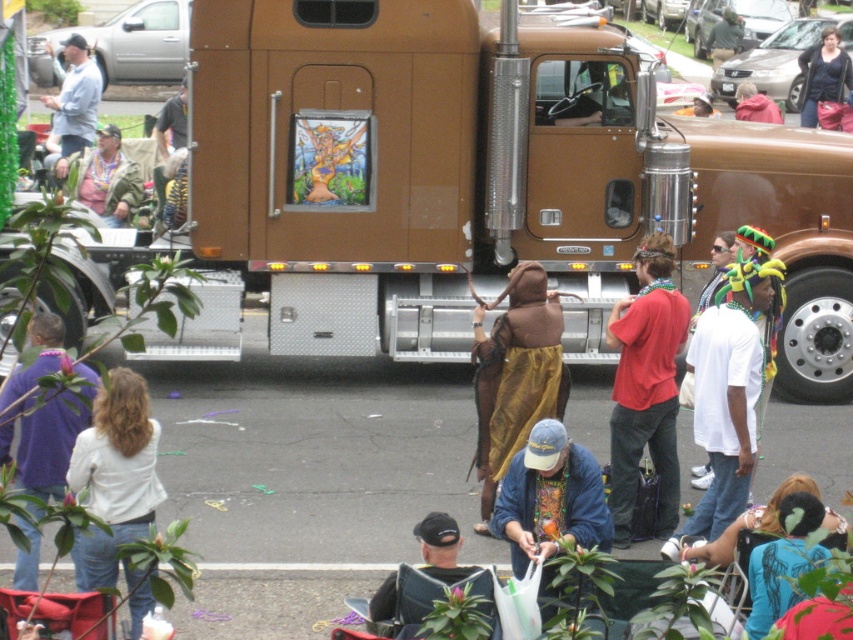
You are a photographer at the parade and want to take a photo of the red cotton shirt at center and the pink fabric at center. Which one is positioned to the left?

The red cotton shirt at center is to the left of the pink fabric at center.

You are standing at the position of the point at coordinates point [666,193] and want to walk towards the point at coordinates point [428,518]. Which direction should you move relative to the truck?

You should move towards the truck because point [666,193] is further away from the camera than point [428,518], meaning the latter is closer to the truck.

You are a photographer trying to capture the scene in front of the large brown semi truck with a distinctive painting of a woman in a colorful dress on its side. You notice the red cotton shirt at center and the pink fabric at center. Which object is positioned closer to you?

The red cotton shirt at center is closer to the viewer than the pink fabric at center.